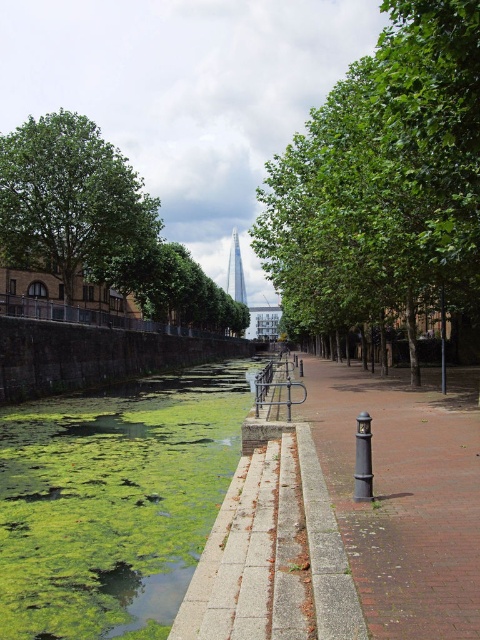
Question: Can you confirm if green algae at center is smaller than brick pavement at center?

Choices:
 (A) no
 (B) yes

Answer: (A)

Question: Can you confirm if green leafy tree at center is smaller than green leafy tree at left?

Choices:
 (A) no
 (B) yes

Answer: (A)

Question: Among these objects, which one is nearest to the camera?

Choices:
 (A) green leafy tree at center
 (B) green algae at center

Answer: (B)

Question: Is green leafy tree at center below green algae at center?

Choices:
 (A) no
 (B) yes

Answer: (A)

Question: Which object is closer to the camera taking this photo?

Choices:
 (A) green algae at center
 (B) green leafy tree at left
 (C) brick pavement at center
 (D) green leafy tree at center

Answer: (C)

Question: Which of the following is the farthest from the observer?

Choices:
 (A) (197, 554)
 (B) (383, 259)
 (C) (437, 509)

Answer: (B)